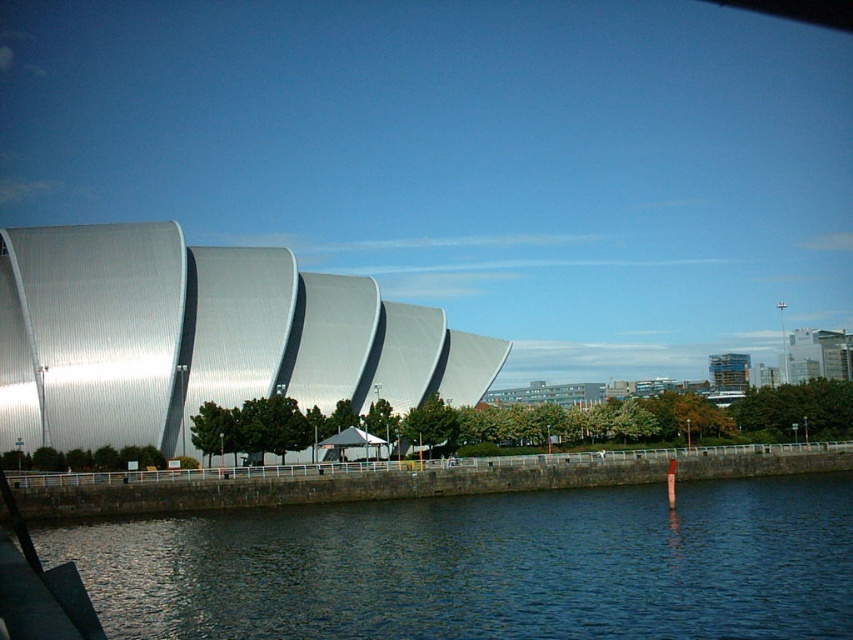
You are standing on the concrete embankment and want to take a photo of the shiny metallic building at left. To ensure the dark blue water at lower center is in the frame, where should you position yourself relative to the building?

You should position yourself to the right of the shiny metallic building at left so that the dark blue water at lower center, which is located below the building, remains visible in the frame.

You are standing on the concrete embankment looking at the scene. Which object is nearer to you between the dark blue water at lower center and the shiny metallic building at left?

The dark blue water at lower center is closer to the viewer than the shiny metallic building at left.